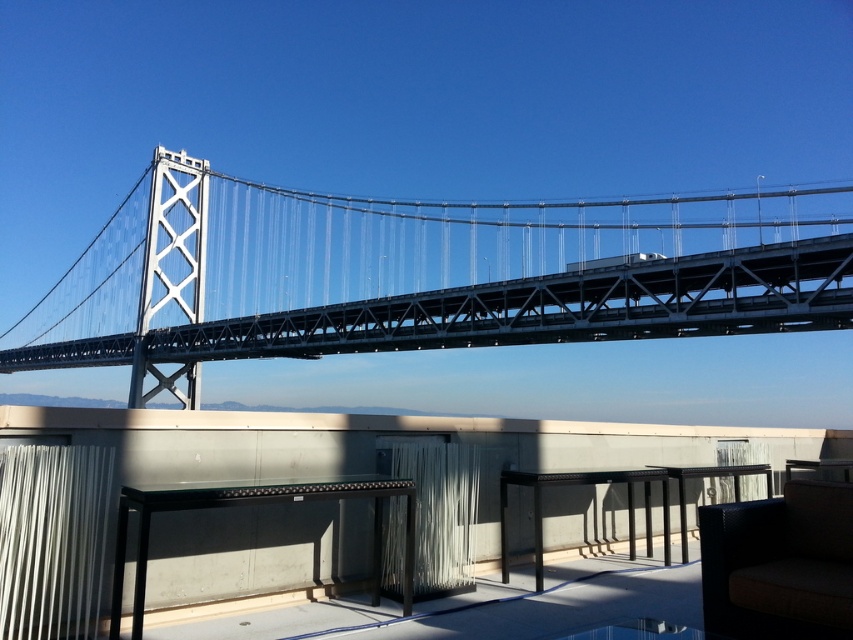
You are standing at the center of the rooftop and want to move towards the dark brown woven chair at lower right. Which direction should you walk to reach it?

You should walk towards the lower right direction to reach the dark brown woven chair at lower right since it is located at point (779,564), which is in the lower right quadrant of the image.

You are standing on the rooftop and want to walk from the point closer to the Oakland Bay Bridge to the point farther away from it. Which path should you take between the two points, point [758,582] and point [683,492]?

To walk from the point closer to the Oakland Bay Bridge to the one farther away, you should go from point [683,492] to point [758,582]. Since point [758,582] is in front of point [683,492], it means it is closer to the viewer on the rooftop, so the farther point is [683,492]. Hence, moving from [683,492] to [758,582] takes you towards the bridge.